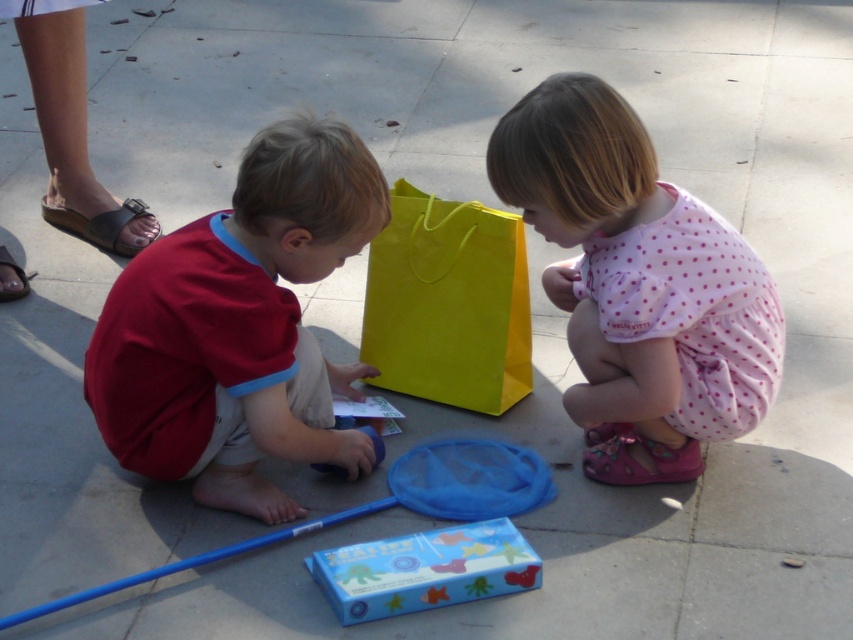
Question: Is matte red shirt at left below yellow paper bag at center?

Choices:
 (A) yes
 (B) no

Answer: (A)

Question: Observing the image, what is the correct spatial positioning of yellow paper bag at center in reference to blue cardboard box at center?

Choices:
 (A) below
 (B) above

Answer: (B)

Question: Estimate the real-world distances between objects in this image. Which object is farther from the yellow paper bag at center?

Choices:
 (A) blue cardboard box at center
 (B) pink dotted fabric at lower right
 (C) matte red shirt at left

Answer: (A)

Question: Which object is positioned closest to the matte red shirt at left?

Choices:
 (A) blue cardboard box at center
 (B) pink dotted fabric at lower right
 (C) yellow paper bag at center

Answer: (A)

Question: Which point is farther to the camera?

Choices:
 (A) (379, 372)
 (B) (490, 582)
 (C) (260, 172)
 (D) (640, 374)

Answer: (A)

Question: Is pink dotted fabric at lower right further to camera compared to yellow paper bag at center?

Choices:
 (A) yes
 (B) no

Answer: (B)